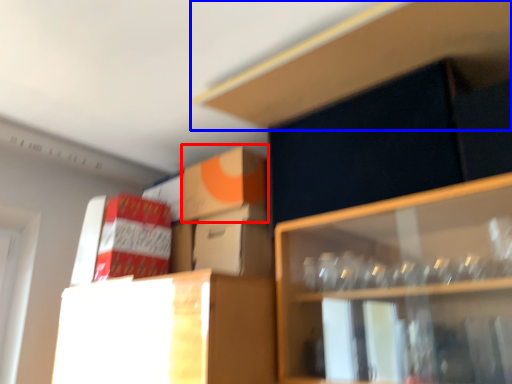
Question: Which of the following is the farthest to the observer, cardboard box (highlighted by a red box) or cabinet (highlighted by a blue box)?

Choices:
 (A) cardboard box
 (B) cabinet

Answer: (A)